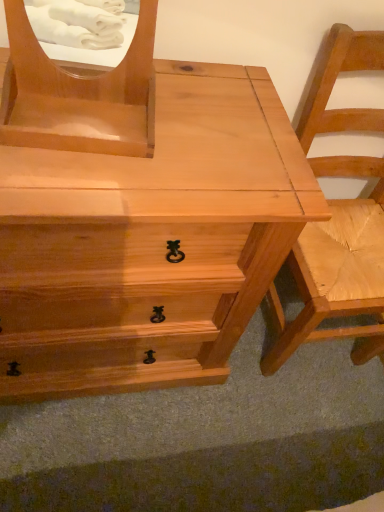
Question: Is matte wood mirror at upper left thinner than natural wood chair at right?

Choices:
 (A) no
 (B) yes

Answer: (B)

Question: Is matte wood mirror at upper left behind natural wood chair at right?

Choices:
 (A) yes
 (B) no

Answer: (B)

Question: Is natural wood chair at right completely or partially inside matte wood mirror at upper left?

Choices:
 (A) yes
 (B) no

Answer: (B)

Question: Does matte wood mirror at upper left touch natural wood chair at right?

Choices:
 (A) yes
 (B) no

Answer: (B)

Question: Is matte wood mirror at upper left turned away from natural wood chair at right?

Choices:
 (A) yes
 (B) no

Answer: (B)

Question: Is matte wood mirror at upper left to the right of natural wood chair at right from the viewer's perspective?

Choices:
 (A) no
 (B) yes

Answer: (A)

Question: From a real-world perspective, is natural wood chair at right on top of matte wood mirror at upper left?

Choices:
 (A) no
 (B) yes

Answer: (A)

Question: Is natural wood chair at right located outside matte wood mirror at upper left?

Choices:
 (A) no
 (B) yes

Answer: (B)

Question: Is matte wood mirror at upper left surrounded by natural wood chair at right?

Choices:
 (A) no
 (B) yes

Answer: (A)

Question: Considering the relative sizes of natural wood chair at right and matte wood mirror at upper left in the image provided, is natural wood chair at right shorter than matte wood mirror at upper left?

Choices:
 (A) no
 (B) yes

Answer: (A)

Question: Does natural wood chair at right have a smaller size compared to matte wood mirror at upper left?

Choices:
 (A) yes
 (B) no

Answer: (B)

Question: Considering the relative sizes of natural wood chair at right and matte wood mirror at upper left in the image provided, is natural wood chair at right thinner than matte wood mirror at upper left?

Choices:
 (A) yes
 (B) no

Answer: (B)

Question: Is natural wood chair at right located within natural wood chest of drawers at center?

Choices:
 (A) yes
 (B) no

Answer: (B)